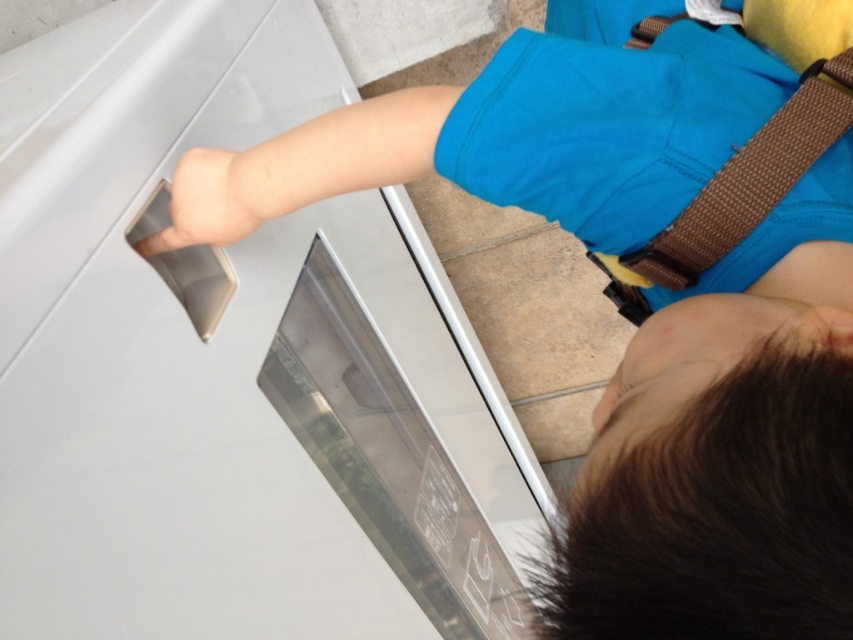
Question: Can you confirm if white glossy dishwasher at upper left is positioned to the left of brown woven strap at upper right?

Choices:
 (A) yes
 (B) no

Answer: (A)

Question: Which point is closer to the camera taking this photo?

Choices:
 (A) (281, 616)
 (B) (233, 228)

Answer: (B)

Question: Where is white glossy dishwasher at upper left located in relation to skinny beige handle at left in the image?

Choices:
 (A) right
 (B) left

Answer: (A)

Question: Is brown woven strap at upper right closer to the viewer compared to skinny beige handle at left?

Choices:
 (A) no
 (B) yes

Answer: (B)

Question: Which of the following is the closest to the observer?

Choices:
 (A) brown woven strap at upper right
 (B) skinny beige handle at left
 (C) white glossy dishwasher at upper left

Answer: (C)

Question: Which point appears closest to the camera in this image?

Choices:
 (A) (83, 621)
 (B) (180, 172)

Answer: (A)